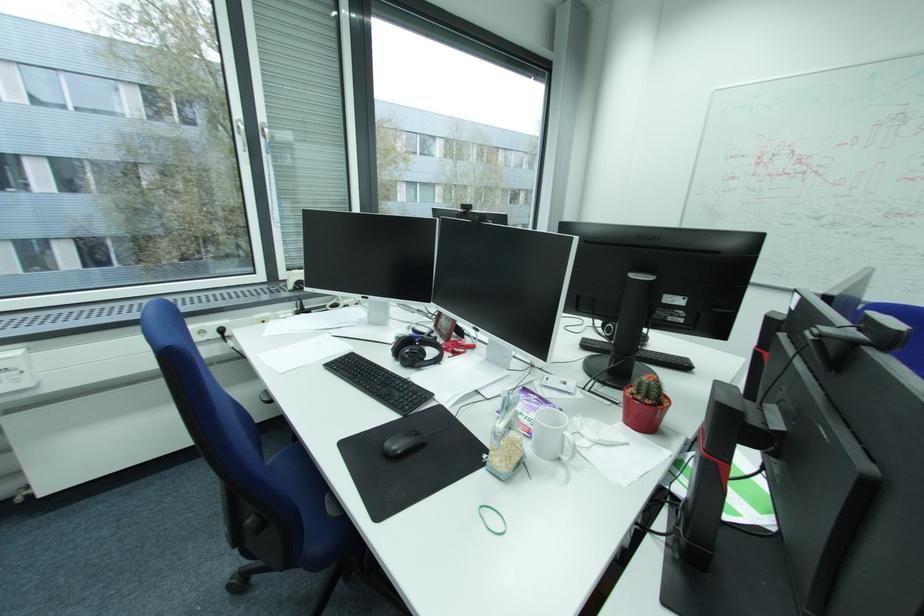
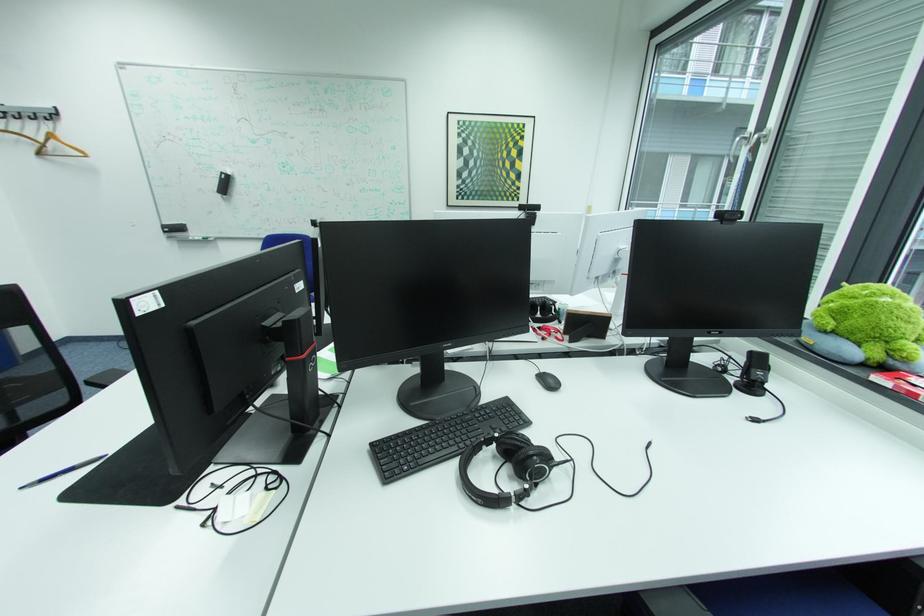
Question: I am providing you with two images of the same scene from different viewpoints. Please identify which objects are invisible in image2.

Choices:
 (A) black phone
 (B) yellow highlighter pen
 (C) green rubber band
 (D) black microphone

Answer: (C)